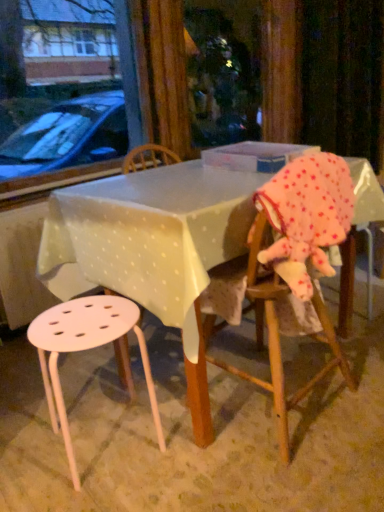
At what (x,y) coordinates should I click in order to perform the action: click on vacant space situated above white plastic stool at lower left (from a real-world perspective). Please return your answer as a coordinate pair (x, y). The width and height of the screenshot is (384, 512). Looking at the image, I should click on (84, 318).